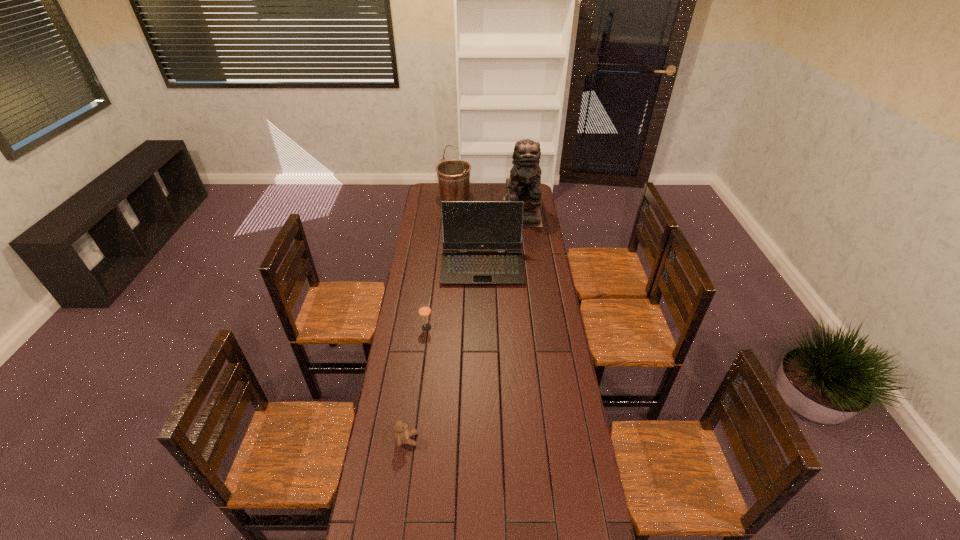
Locate an element on the screen. The image size is (960, 540). object that is the second closest one to the sculpture is located at coordinates (453, 176).

You are a GUI agent. You are given a task and a screenshot of the screen. Output one action in this format:
    pyautogui.click(x=<x>, y=<y>)
    Task: Click on the object that is the third closest to the fourth shortest object
    
    Given the screenshot: What is the action you would take?
    pyautogui.click(x=424, y=310)

What are the coordinates of `vacant space that satisfies the following two spatial constraints: 1. on the screen of the third nearest object; 2. on the front-facing side of the nearest object` in the screenshot? It's located at (x=483, y=440).